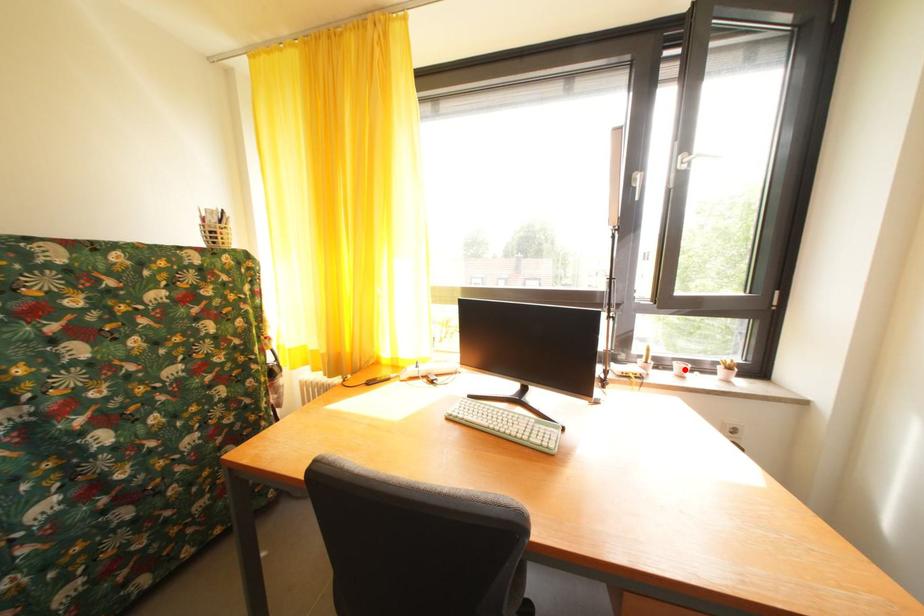
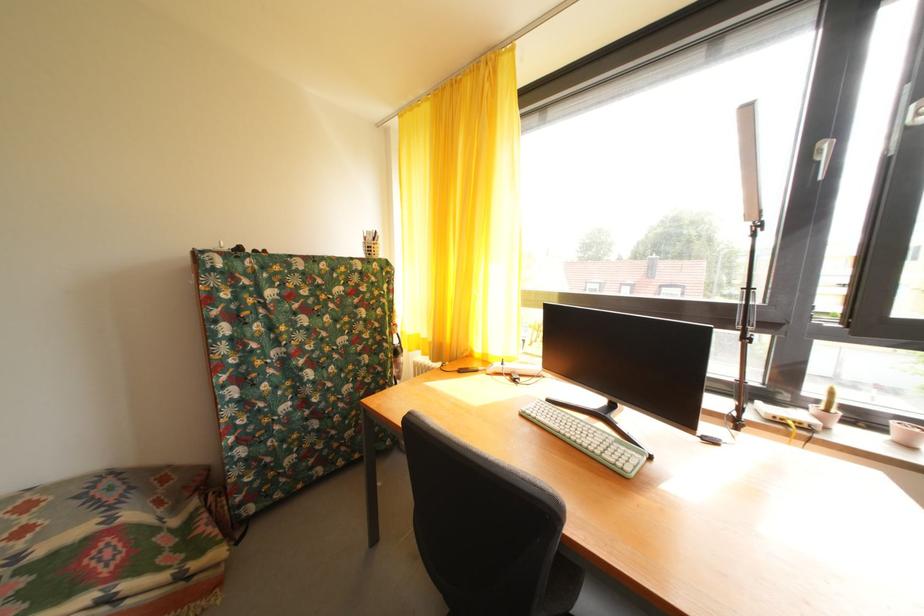
Find the pixel in the second image that matches the highlighted location in the first image.

(904, 430)